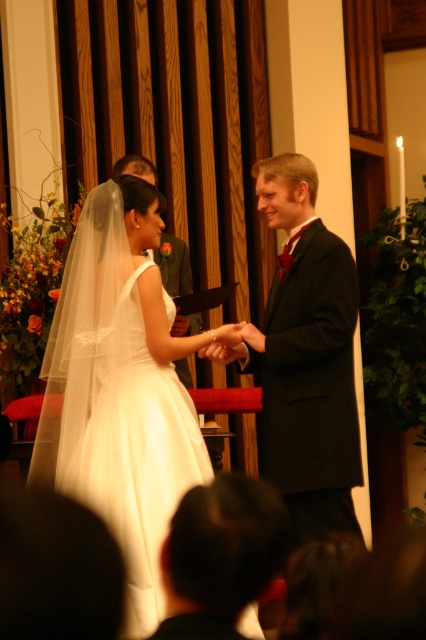
Between point (141, 268) and point (189, 330), which one is positioned in front?

Point (141, 268) is in front.

Looking at this image, does white satin dress at center appear under smooth black suit at center?

Correct, white satin dress at center is located below smooth black suit at center.

Who is more forward, (x=154, y=564) or (x=186, y=285)?

Point (x=154, y=564) is more forward.

You are a GUI agent. You are given a task and a screenshot of the screen. Output one action in this format:
    pyautogui.click(x=<x>, y=<y>)
    Task: Click on the white satin dress at center
    
    Given the screenshot: What is the action you would take?
    pyautogui.click(x=120, y=388)

Is black satin suit at center to the left of smooth black suit at center from the viewer's perspective?

No, black satin suit at center is not to the left of smooth black suit at center.

Which is in front, point (354, 515) or point (180, 285)?

Point (354, 515) is more forward.

Identify the location of black satin suit at center. (305, 355).

Which of these two, white satin dress at center or black satin suit at center, stands taller?

With more height is white satin dress at center.

Which is more to the left, white satin dress at center or black satin suit at center?

white satin dress at center is more to the left.

This screenshot has height=640, width=426. What do you see at coordinates (120, 388) in the screenshot?
I see `white satin dress at center` at bounding box center [120, 388].

The width and height of the screenshot is (426, 640). In order to click on white satin dress at center in this screenshot , I will do `click(120, 388)`.